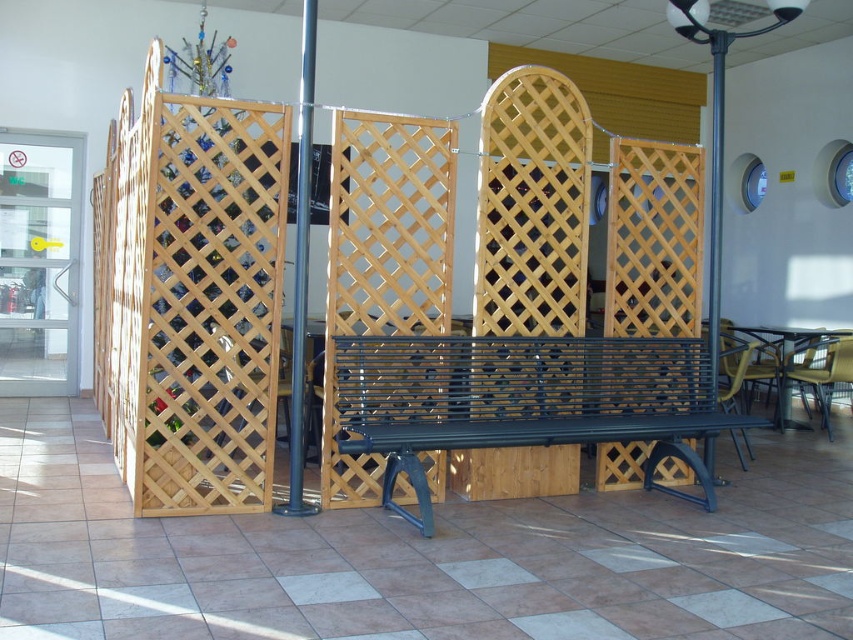
Does natural wood lattice at center have a smaller size compared to metallic pole at right?

No, natural wood lattice at center is not smaller than metallic pole at right.

Between natural wood lattice at center and metallic pole at right, which one is positioned higher?

Positioned higher is metallic pole at right.

Locate an element on the screen. Image resolution: width=853 pixels, height=640 pixels. natural wood lattice at center is located at coordinates (189, 296).

Which of these two, natural wood lattice at center or metallic pole at center, stands shorter?

natural wood lattice at center is shorter.

Which is behind, point (102, 376) or point (277, 508)?

Positioned behind is point (102, 376).

At what (x,y) coordinates should I click in order to perform the action: click on natural wood lattice at center. Please return your answer as a coordinate pair (x, y). The height and width of the screenshot is (640, 853). Looking at the image, I should click on (189, 296).

The image size is (853, 640). Identify the location of natural wood lattice at center. (189, 296).

Between black metal bench at center and metallic pole at right, which one is positioned higher?

metallic pole at right is above.

Describe the element at coordinates (523, 401) in the screenshot. The height and width of the screenshot is (640, 853). I see `black metal bench at center` at that location.

The width and height of the screenshot is (853, 640). Identify the location of black metal bench at center. (523, 401).